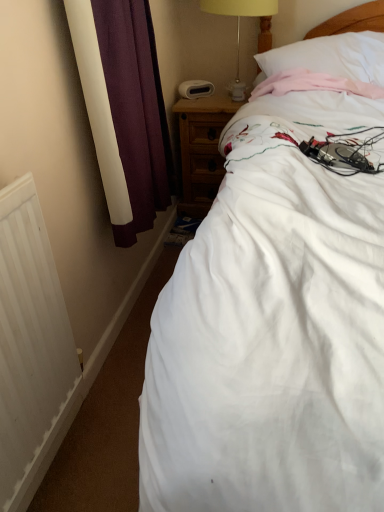
Question: Is white soft pillow at upper right facing away from yellow fabric lampshade at upper center?

Choices:
 (A) no
 (B) yes

Answer: (A)

Question: Does white soft pillow at upper right have a lesser height compared to yellow fabric lampshade at upper center?

Choices:
 (A) yes
 (B) no

Answer: (A)

Question: Is the position of white soft pillow at upper right less distant than that of yellow fabric lampshade at upper center?

Choices:
 (A) no
 (B) yes

Answer: (B)

Question: Can you confirm if white soft pillow at upper right is positioned to the right of yellow fabric lampshade at upper center?

Choices:
 (A) no
 (B) yes

Answer: (B)

Question: Is white soft pillow at upper right aimed at yellow fabric lampshade at upper center?

Choices:
 (A) no
 (B) yes

Answer: (A)

Question: Based on their positions, is white matte radiator at lower left located to the left or right of yellow fabric lampshade at upper center?

Choices:
 (A) left
 (B) right

Answer: (A)

Question: Relative to yellow fabric lampshade at upper center, is white matte radiator at lower left in front or behind?

Choices:
 (A) behind
 (B) front

Answer: (B)

Question: From the image's perspective, is white matte radiator at lower left located above or below yellow fabric lampshade at upper center?

Choices:
 (A) above
 (B) below

Answer: (B)

Question: Looking at their shapes, would you say white matte radiator at lower left is wider or thinner than yellow fabric lampshade at upper center?

Choices:
 (A) thin
 (B) wide

Answer: (A)

Question: In terms of height, does wooden nightstand at upper right look taller or shorter compared to white matte radiator at lower left?

Choices:
 (A) short
 (B) tall

Answer: (A)

Question: Does point 201,163 appear closer or farther from the camera than point 3,226?

Choices:
 (A) closer
 (B) farther

Answer: (B)

Question: Is wooden nightstand at upper right to the left or to the right of white matte radiator at lower left in the image?

Choices:
 (A) left
 (B) right

Answer: (B)

Question: Looking at their shapes, would you say wooden nightstand at upper right is wider or thinner than white matte radiator at lower left?

Choices:
 (A) wide
 (B) thin

Answer: (A)

Question: Relative to yellow fabric lampshade at upper center, is white soft pillow at upper right in front or behind?

Choices:
 (A) behind
 (B) front

Answer: (B)

Question: Based on their positions, is white soft pillow at upper right located to the left or right of yellow fabric lampshade at upper center?

Choices:
 (A) left
 (B) right

Answer: (B)